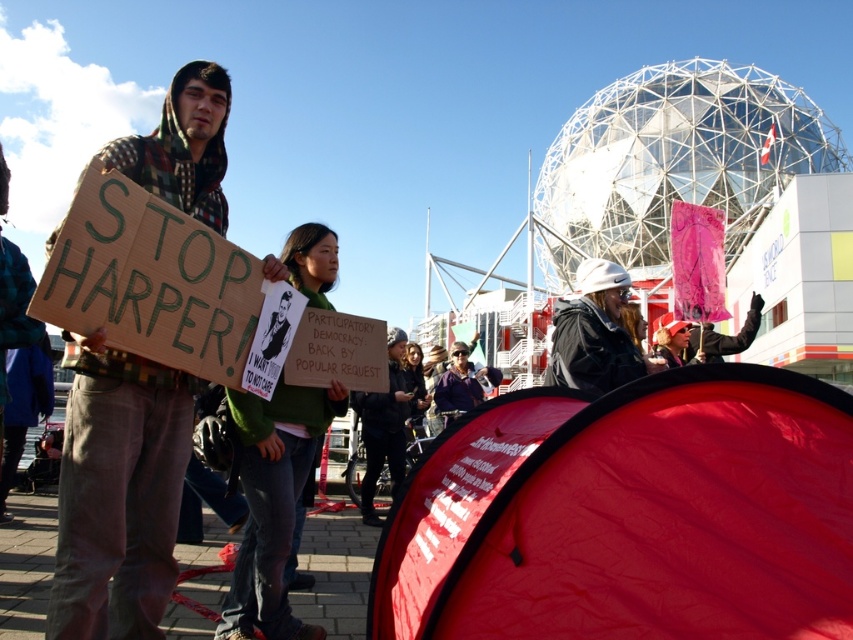
You are a photographer trying to capture a clear shot of both the green fabric shirt at center and the white matte helmet at upper center. Based on their positions, which object should you focus on first to ensure both are in frame?

The green fabric shirt at center is positioned under the white matte helmet at upper center, so you should focus on the white matte helmet at upper center first to ensure both are in frame.

Looking at the protest scene, there are two items of clothing visible in the image. The first is a green fabric shirt at center, and the second is a white matte helmet at upper center. Which of these two items is positioned more to the left side of the image?

The green fabric shirt at center is positioned more to the left side of the image than the white matte helmet at upper center.

Based on the scene description, if someone is looking directly at the green fabric shirt at center, would they also be able to see the white matte helmet at upper center?

The green fabric shirt at center is in front of the white matte helmet at upper center, so if someone is looking directly at the green fabric shirt at center, they would not be able to see the white matte helmet at upper center because it is obscured by the shirt.